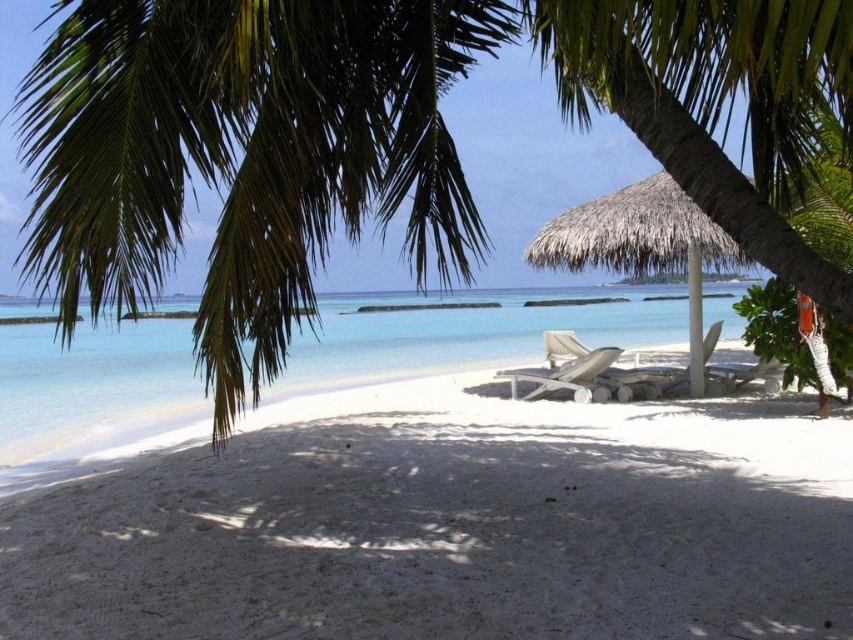
You are standing on the beach and want to take a photo of both the green leafy palm tree at upper left and the clear blue water at center. Which object should you zoom in on first to ensure both are in the frame?

The green leafy palm tree at upper left is shorter than the clear blue water at center, so you should zoom in on the clear blue water at center first to ensure both are in the frame.